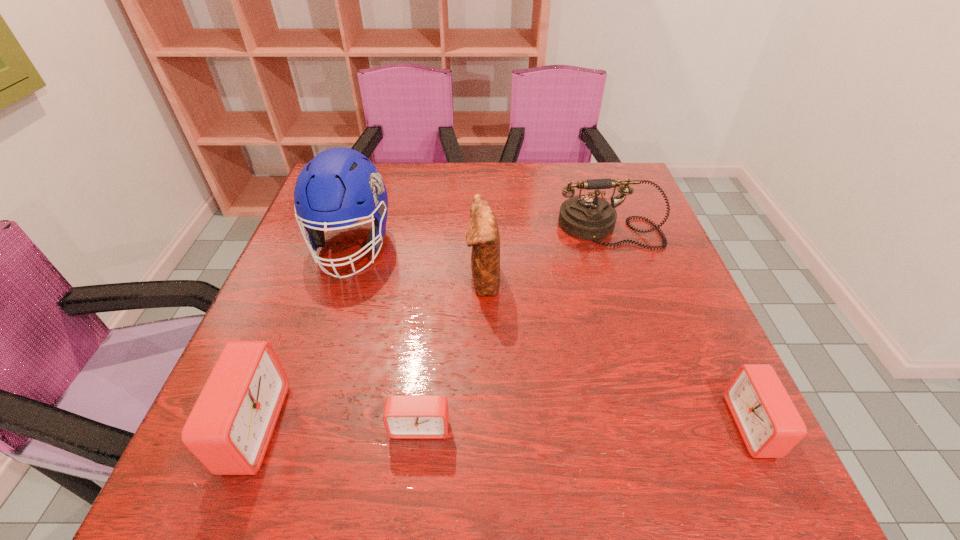
I want to click on free space between the clutch bag and the second tallest alarm clock, so click(617, 352).

The height and width of the screenshot is (540, 960). I want to click on object that is the fifth nearest to the second alarm clock from left to right, so click(587, 217).

At what (x,y) coordinates should I click in order to perform the action: click on object that is the second nearest to the telephone. Please return your answer as a coordinate pair (x, y). The height and width of the screenshot is (540, 960). Looking at the image, I should click on (770, 425).

Identify which alarm clock is located as the nearest to the tallest object. Please provide its 2D coordinates. Your answer should be formatted as a tuple, i.e. [(x, y)], where the tuple contains the x and y coordinates of a point satisfying the conditions above.

[(230, 426)]

Identify the location of alarm clock that is the third closest one to the clutch bag. The image size is (960, 540). (770, 425).

Locate an element on the screen. free space that satisfies the following two spatial constraints: 1. on the front-facing side of the football helmet; 2. on the front-facing side of the tallest alarm clock is located at coordinates (293, 428).

Image resolution: width=960 pixels, height=540 pixels. Find the location of `free space that satisfies the following two spatial constraints: 1. on the front side of the telephone; 2. on the front-facing side of the tallest alarm clock`. free space that satisfies the following two spatial constraints: 1. on the front side of the telephone; 2. on the front-facing side of the tallest alarm clock is located at coordinates (675, 428).

Find the location of a particular element. This screenshot has width=960, height=540. blank area in the image that satisfies the following two spatial constraints: 1. on the open side of the fifth shortest object; 2. on the front-facing side of the shortest alarm clock is located at coordinates (484, 427).